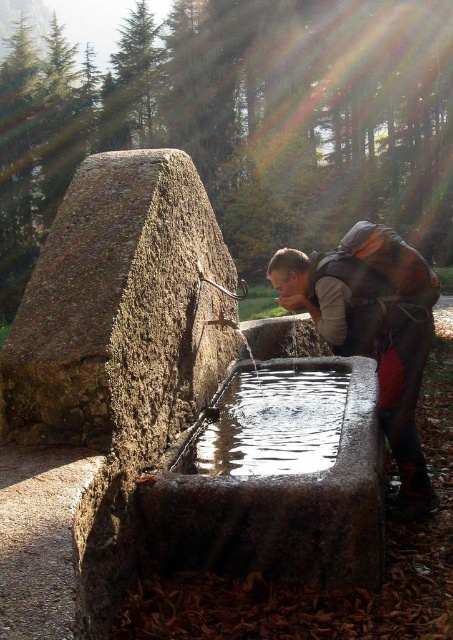
Question: Which point is farther from the camera taking this photo?

Choices:
 (A) (394, 429)
 (B) (77, 400)
 (C) (340, 396)
 (D) (173, 474)

Answer: (C)

Question: Can you confirm if rough textured stone at center is bigger than clear glass water at center?

Choices:
 (A) no
 (B) yes

Answer: (A)

Question: Among these objects, which one is nearest to the camera?

Choices:
 (A) granite water trough at center
 (B) matte gray backpack at lower right
 (C) clear glass water at center

Answer: (A)

Question: Among these objects, which one is farthest from the camera?

Choices:
 (A) clear glass water at center
 (B) matte gray backpack at lower right
 (C) rough textured stone at center

Answer: (B)

Question: Can you confirm if rough textured stone at center is bigger than matte gray backpack at lower right?

Choices:
 (A) yes
 (B) no

Answer: (B)

Question: Observing the image, what is the correct spatial positioning of rough textured stone at center in reference to matte gray backpack at lower right?

Choices:
 (A) right
 (B) left

Answer: (B)